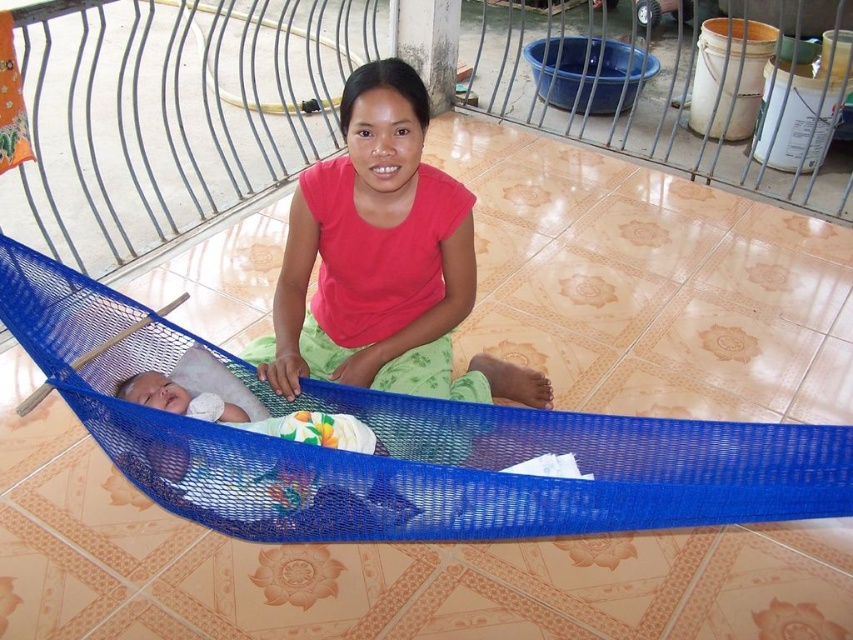
You are a photographer trying to capture a closeup of the blue mesh hammock at center and the white soft baby at center. Given that your camera can only focus on objects within 40 centimeters of each other, will you be able to take a clear photo of both subjects at the same time?

The blue mesh hammock at center and white soft baby at center are 42.41 centimeters apart, which exceeds the camera focus range of 40 centimeters. Therefore, you cannot take a clear photo of both subjects simultaneously.

You are a photographer setting up for a family photo. You need to ensure the blue mesh hammock at center and the white soft baby at center are both visible in the frame. Based on their sizes, which object should you focus on to ensure both are in the shot?

The blue mesh hammock at center is larger in size than the white soft baby at center, so focusing on the larger hammock will help ensure both are visible in the frame.

You are a photographer standing 1.5 meters away from the blue mesh hammock at center. Can you reach it without moving your feet?

The blue mesh hammock at center is 1.41 meters away from the viewer. Since you are standing 1.5 meters away, you can just barely reach it without moving your feet.